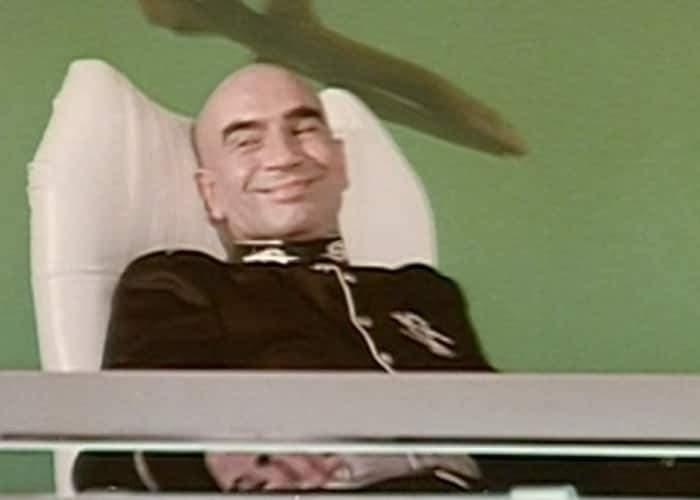
Where is `chair`? The width and height of the screenshot is (700, 500). chair is located at coordinates pos(136,187).